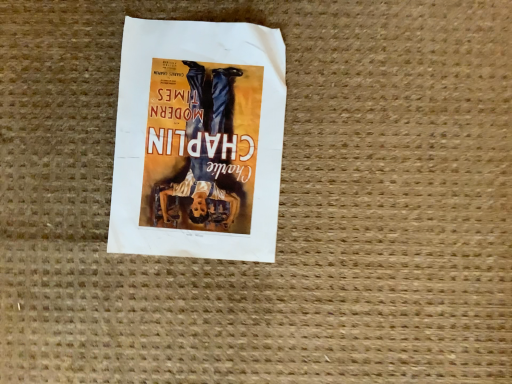
Measure the distance between matte paper poster at center and camera.

matte paper poster at center and camera are 21.01 inches apart from each other.

Describe the element at coordinates (198, 140) in the screenshot. The image size is (512, 384). I see `matte paper poster at center` at that location.

Identify the location of matte paper poster at center. (198, 140).

At what (x,y) coordinates should I click in order to perform the action: click on matte paper poster at center. Please return your answer as a coordinate pair (x, y). The image size is (512, 384). Looking at the image, I should click on (198, 140).